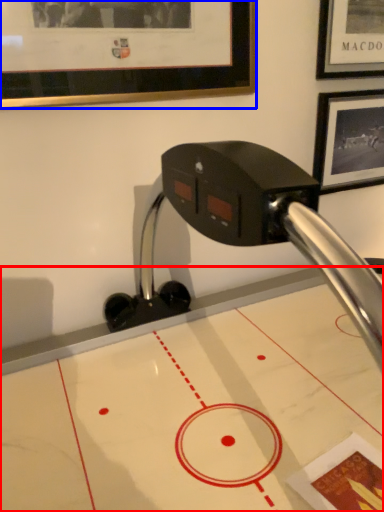
Question: Which point is further to the camera, table (highlighted by a red box) or picture frame (highlighted by a blue box)?

Choices:
 (A) table
 (B) picture frame

Answer: (B)